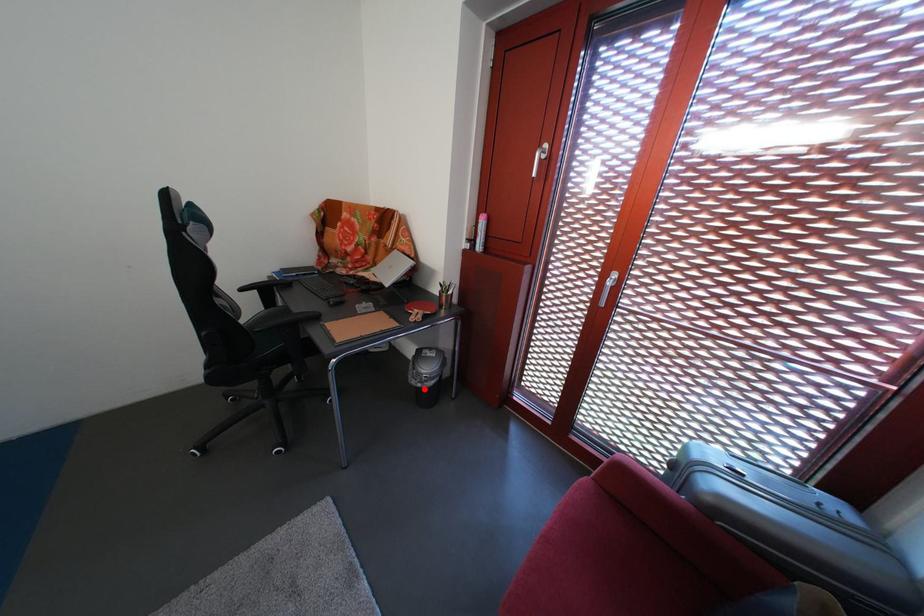
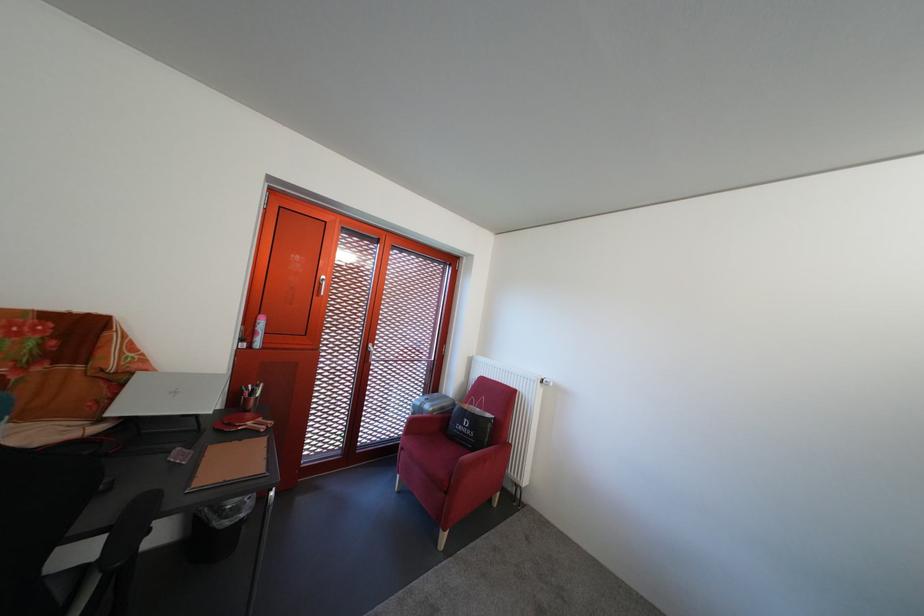
Locate, in the second image, the point that corresponds to the highlighted location in the first image.

(237, 530)